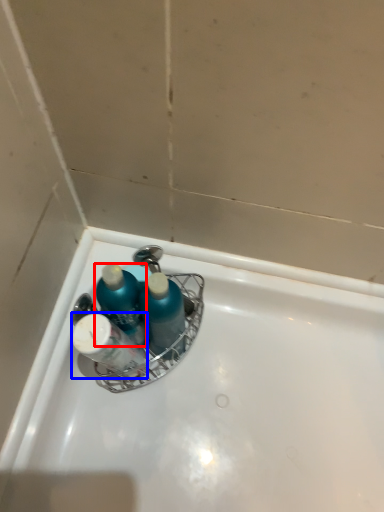
Question: Which object is further to the camera taking this photo, mouthwash (highlighted by a red box) or toiletry (highlighted by a blue box)?

Choices:
 (A) mouthwash
 (B) toiletry

Answer: (A)